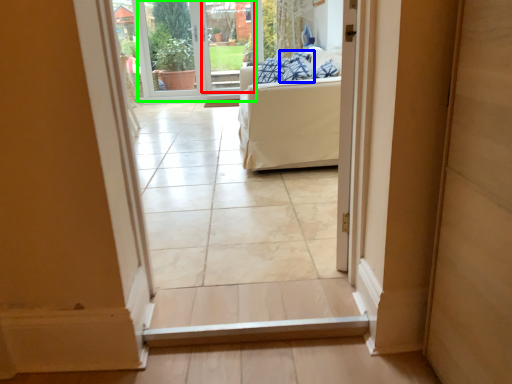
Question: Estimate the real-world distances between objects in this image. Which object is closer to glass door (highlighted by a red box), pillow (highlighted by a blue box) or window screen (highlighted by a green box)?

Choices:
 (A) pillow
 (B) window screen

Answer: (B)